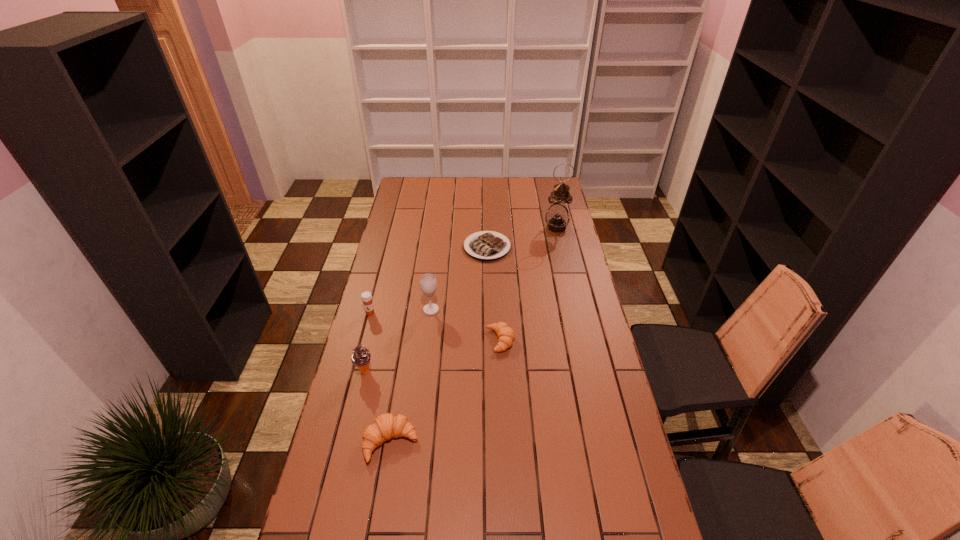
Identify the location of icecream situated at the left edge. (361, 358).

In order to click on object that is at the right edge in this screenshot , I will do `click(557, 217)`.

At what (x,y) coordinates should I click in order to perform the action: click on vacant region at the far edge. Please return your answer as a coordinate pair (x, y). Looking at the image, I should click on (432, 183).

This screenshot has width=960, height=540. Find the location of `vacant space at the left edge of the desktop`. vacant space at the left edge of the desktop is located at coordinates (397, 220).

I want to click on blank space at the right edge of the desktop, so click(x=554, y=247).

Locate an element on the screen. free region at the far right corner is located at coordinates (548, 187).

Where is `vacant area that lies between the farther crescent roll and the icecream`? vacant area that lies between the farther crescent roll and the icecream is located at coordinates (432, 356).

Identify the location of free space between the shortest object and the shorter crescent roll. (493, 294).

The height and width of the screenshot is (540, 960). Identify the location of free spot between the third tallest object and the sixth shortest object. (397, 341).

Image resolution: width=960 pixels, height=540 pixels. I want to click on free spot between the plate and the third shortest object, so click(439, 345).